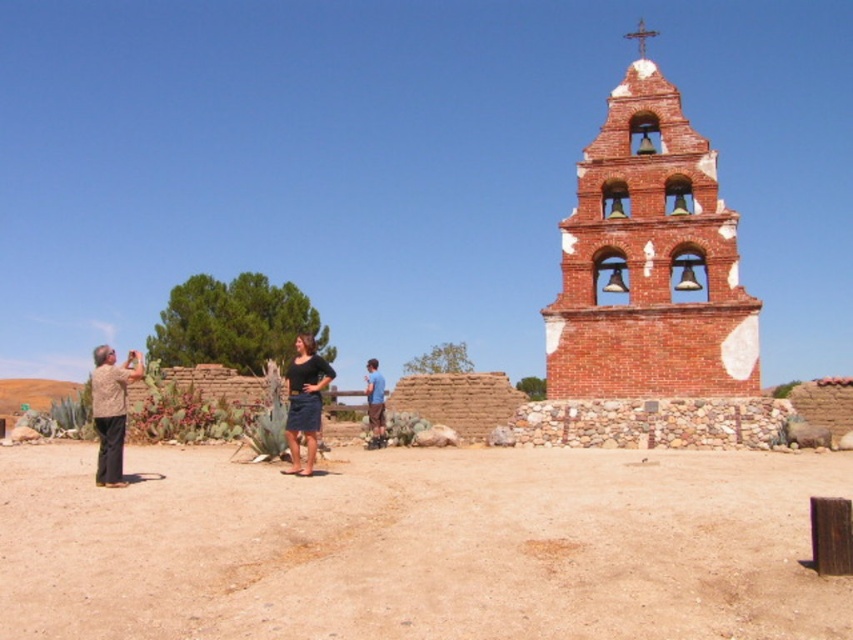
Does camouflage fabric shirt at left appear on the right side of dark blue denim skirt at center?

Incorrect, camouflage fabric shirt at left is not on the right side of dark blue denim skirt at center.

Can you confirm if camouflage fabric shirt at left is positioned above dark blue denim skirt at center?

Actually, camouflage fabric shirt at left is below dark blue denim skirt at center.

Describe the element at coordinates (111, 410) in the screenshot. I see `camouflage fabric shirt at left` at that location.

Locate an element on the screen. The height and width of the screenshot is (640, 853). camouflage fabric shirt at left is located at coordinates (111, 410).

Where is `brown sandy dirt at lower center`? The image size is (853, 640). brown sandy dirt at lower center is located at coordinates (419, 547).

This screenshot has width=853, height=640. Identify the location of brown sandy dirt at lower center. (419, 547).

Locate an element on the screen. This screenshot has height=640, width=853. brown sandy dirt at lower center is located at coordinates (419, 547).

Does dark blue denim skirt at center appear under blue cotton shirt at center?

No, dark blue denim skirt at center is not below blue cotton shirt at center.

Does point (305, 333) come closer to viewer compared to point (366, 364)?

That is False.

This screenshot has width=853, height=640. I want to click on dark blue denim skirt at center, so click(x=305, y=403).